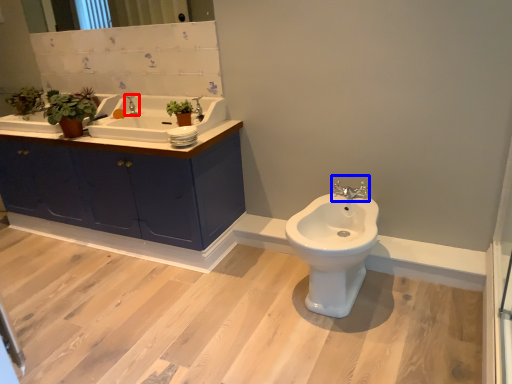
Question: Among these objects, which one is farthest to the camera, tap (highlighted by a red box) or tap (highlighted by a blue box)?

Choices:
 (A) tap
 (B) tap

Answer: (A)